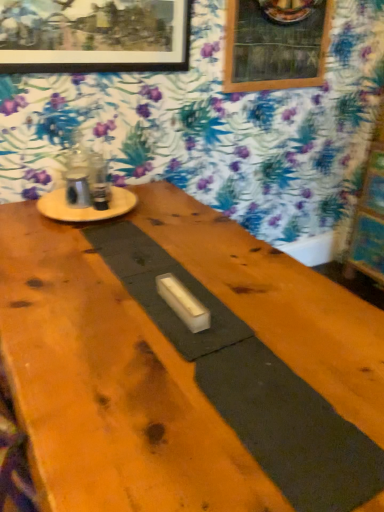
Describe the element at coordinates (188, 367) in the screenshot. I see `smooth wood table at center` at that location.

The height and width of the screenshot is (512, 384). Describe the element at coordinates (85, 207) in the screenshot. I see `wooden round table at upper left` at that location.

You are a GUI agent. You are given a task and a screenshot of the screen. Output one action in this format:
    pyautogui.click(x=<x>, y=<y>)
    Task: Click on the wooden bulletin board at right
    The width and height of the screenshot is (384, 512).
    Given the screenshot: What is the action you would take?
    click(370, 214)

Based on the photo, which of these two, wooden round table at upper left or smooth wood table at center, stands taller?

Standing taller between the two is wooden round table at upper left.

Based on their sizes in the image, would you say wooden round table at upper left is bigger or smaller than smooth wood table at center?

Considering their sizes, wooden round table at upper left takes up more space than smooth wood table at center.

Which is in front, wooden round table at upper left or smooth wood table at center?

smooth wood table at center is more forward.

Is point (369, 354) closer to viewer compared to point (24, 33)?

Yes.

Is smooth wood table at center in front of or behind wooden picture frame at upper left, the 2th picture frame positioned from the back, in the image?

Clearly, smooth wood table at center is in front of wooden picture frame at upper left, the 2th picture frame positioned from the back.

Considering the sizes of objects smooth wood table at center and wooden picture frame at upper left, which is counted as the 1th picture frame, starting from the front, in the image provided, who is smaller, smooth wood table at center or wooden picture frame at upper left, which is counted as the 1th picture frame, starting from the front,?

With smaller size is smooth wood table at center.

Is smooth wood table at center situated inside wooden picture frame at upper left, the first picture frame viewed from the left, or outside?

smooth wood table at center exists outside the volume of wooden picture frame at upper left, the first picture frame viewed from the left.

This screenshot has height=512, width=384. What are the coordinates of `the 2nd picture frame positioned above the smooth wood table at center (from the image's perspective)` in the screenshot? It's located at (274, 49).

Which of these two, smooth wood table at center or wooden picture frame at upper center, the 2th picture frame positioned from the front, is bigger?

wooden picture frame at upper center, the 2th picture frame positioned from the front, is bigger.

Does point (98, 265) come in front of point (304, 32)?

Yes, point (98, 265) is in front of point (304, 32).

How far apart are wooden round table at upper left and wooden picture frame at upper center, positioned as the 2th picture frame in left-to-right order?

The distance of wooden round table at upper left from wooden picture frame at upper center, positioned as the 2th picture frame in left-to-right order, is 3.58 feet.

Is wooden round table at upper left wider than wooden picture frame at upper center, the 2th picture frame positioned from the front?

Yes, wooden round table at upper left is wider than wooden picture frame at upper center, the 2th picture frame positioned from the front.

How many degrees apart are the facing directions of wooden round table at upper left and wooden picture frame at upper center, the first picture frame from the right?

0.834 degrees separate the facing orientations of wooden round table at upper left and wooden picture frame at upper center, the first picture frame from the right.

Based on the photo, is wooden round table at upper left looking in the opposite direction of wooden picture frame at upper center, positioned as the 2th picture frame in left-to-right order?

wooden round table at upper left is not turned away from wooden picture frame at upper center, positioned as the 2th picture frame in left-to-right order.

Could you tell me if wooden bulletin board at right is facing wooden picture frame at upper center, the 2th picture frame positioned from the front?

No.

Is wooden bulletin board at right completely or partially outside of wooden picture frame at upper center, positioned as the first picture frame in back-to-front order?

Absolutely, wooden bulletin board at right is external to wooden picture frame at upper center, positioned as the first picture frame in back-to-front order.

From a real-world perspective, relative to wooden picture frame at upper center, positioned as the first picture frame in back-to-front order, is wooden bulletin board at right vertically above or below?

wooden bulletin board at right is below wooden picture frame at upper center, positioned as the first picture frame in back-to-front order.

Is wooden round table at upper left facing towards wooden bulletin board at right?

No, wooden round table at upper left is not facing towards wooden bulletin board at right.

From a real-world perspective, is wooden round table at upper left located beneath wooden bulletin board at right?

No, from a real-world perspective, wooden round table at upper left is not beneath wooden bulletin board at right.

Is wooden round table at upper left shorter than wooden bulletin board at right?

Yes.

From the image's perspective, relative to wooden bulletin board at right, is wooden round table at upper left above or below?

wooden round table at upper left is situated higher than wooden bulletin board at right in the image.

Is wooden bulletin board at right positioned far away from wooden round table at upper left?

Yes, wooden bulletin board at right and wooden round table at upper left are located far from each other.

Between wooden bulletin board at right and wooden round table at upper left, which one has larger width?

Wider between the two is wooden bulletin board at right.

From the image's perspective, relative to wooden round table at upper left, is wooden bulletin board at right above or below?

wooden bulletin board at right is below wooden round table at upper left.

Considering the relative positions of wooden bulletin board at right and wooden round table at upper left in the image provided, is wooden bulletin board at right in front of wooden round table at upper left?

No.

What are the coordinates of `table that appears below the wooden round table at upper left (from a real-world perspective)` in the screenshot? It's located at (188, 367).

Locate an element on the screen. This screenshot has height=512, width=384. table that appears in front of the wooden picture frame at upper left, the 2th picture frame from the right is located at coordinates (x=188, y=367).

Based on their spatial positions, is wooden round table at upper left or wooden picture frame at upper center, positioned as the 2th picture frame in left-to-right order, further from wooden picture frame at upper left, the first picture frame viewed from the left?

wooden round table at upper left lies further to wooden picture frame at upper left, the first picture frame viewed from the left, than the other object.

Which object lies further to the anchor point smooth wood table at center, wooden bulletin board at right or wooden picture frame at upper left, the 2th picture frame positioned from the back?

wooden bulletin board at right.

Estimate the real-world distances between objects in this image. Which object is further from wooden round table at upper left, wooden picture frame at upper left, the 2th picture frame from the right, or smooth wood table at center?

Based on the image, wooden picture frame at upper left, the 2th picture frame from the right, appears to be further to wooden round table at upper left.

Based on their spatial positions, is wooden round table at upper left or smooth wood table at center further from wooden bulletin board at right?

The object further to wooden bulletin board at right is smooth wood table at center.

Considering their positions, is wooden picture frame at upper center, positioned as the first picture frame in back-to-front order, positioned further to smooth wood table at center than wooden round table at upper left?

wooden picture frame at upper center, positioned as the first picture frame in back-to-front order, lies further to smooth wood table at center than the other object.

Looking at the image, which one is located further to wooden picture frame at upper left, the 2th picture frame positioned from the back, wooden bulletin board at right or wooden picture frame at upper center, positioned as the first picture frame in back-to-front order?

wooden bulletin board at right lies further to wooden picture frame at upper left, the 2th picture frame positioned from the back, than the other object.

Based on their spatial positions, is wooden picture frame at upper left, the 2th picture frame from the right, or smooth wood table at center closer to wooden bulletin board at right?

smooth wood table at center is positioned closer to the anchor wooden bulletin board at right.

Based on their spatial positions, is smooth wood table at center or wooden picture frame at upper left, which is counted as the 1th picture frame, starting from the front, closer to wooden picture frame at upper center, positioned as the 2th picture frame in left-to-right order?

wooden picture frame at upper left, which is counted as the 1th picture frame, starting from the front, lies closer to wooden picture frame at upper center, positioned as the 2th picture frame in left-to-right order, than the other object.

The width and height of the screenshot is (384, 512). I want to click on table between wooden picture frame at upper left, which is counted as the 1th picture frame, starting from the front, and wooden bulletin board at right, so click(188, 367).

Locate an element on the screen. The height and width of the screenshot is (512, 384). picture frame between wooden picture frame at upper left, the 2th picture frame positioned from the back, and wooden bulletin board at right, in the horizontal direction is located at coordinates (274, 49).

At what (x,y) coordinates should I click in order to perform the action: click on picture frame between smooth wood table at center and wooden picture frame at upper center, positioned as the first picture frame in back-to-front order, from front to back. Please return your answer as a coordinate pair (x, y). The width and height of the screenshot is (384, 512). Looking at the image, I should click on (93, 35).

Identify the location of round table between wooden picture frame at upper left, the 2th picture frame positioned from the back, and smooth wood table at center vertically. Image resolution: width=384 pixels, height=512 pixels. (85, 207).